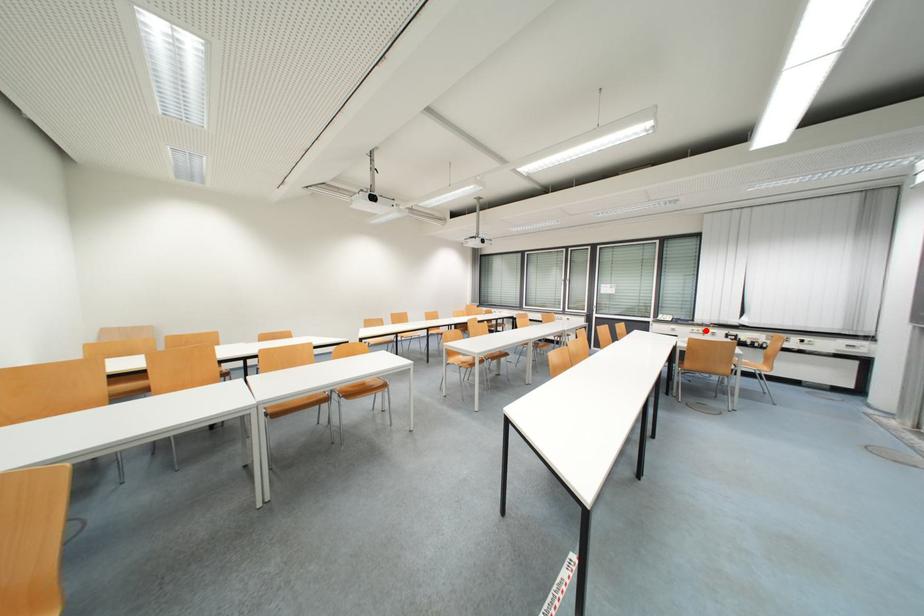
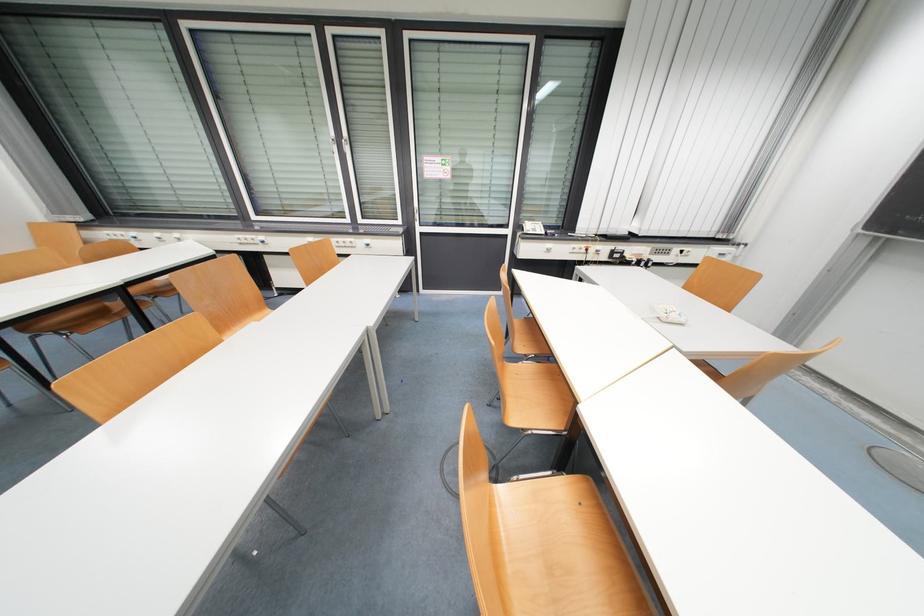
Find the pixel in the second image that matches the highlighted location in the first image.

(589, 246)